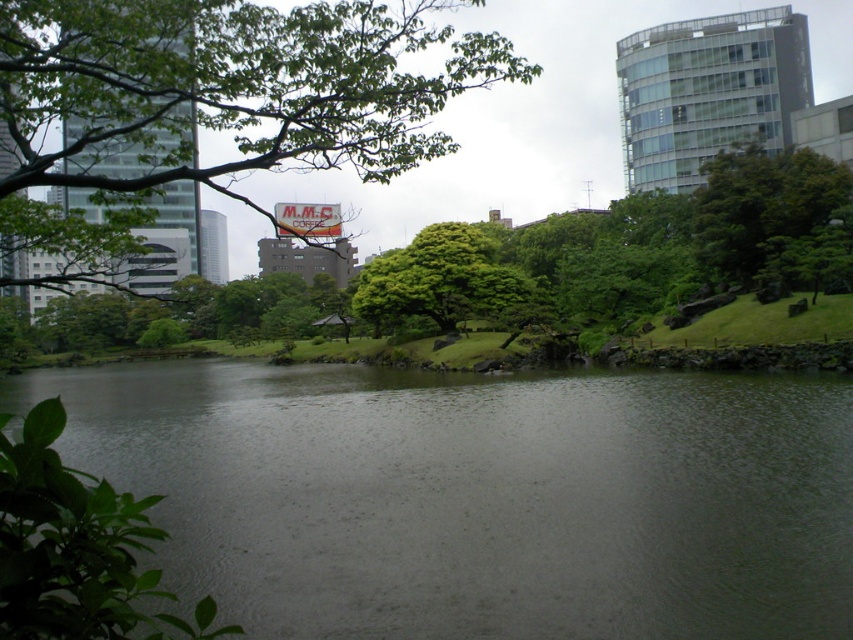
You are a park visitor standing at the edge of the green water at center and want to walk towards the green leafy tree at center. In which direction should you move?

The green water at center is to the left of green leafy tree at center, so you should move to the right to reach the green leafy tree at center.